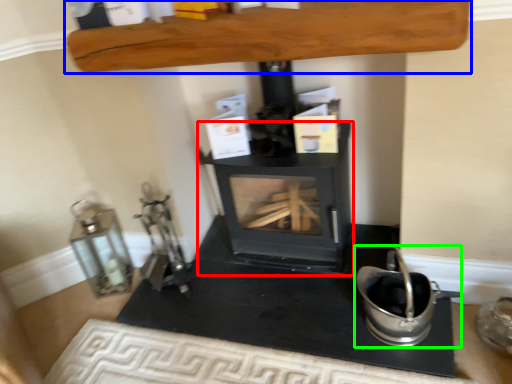
Question: Which object is the closest to the wood burning stove (highlighted by a red box)? Choose among these: furniture (highlighted by a blue box) or appliance (highlighted by a green box).

Choices:
 (A) furniture
 (B) appliance

Answer: (B)